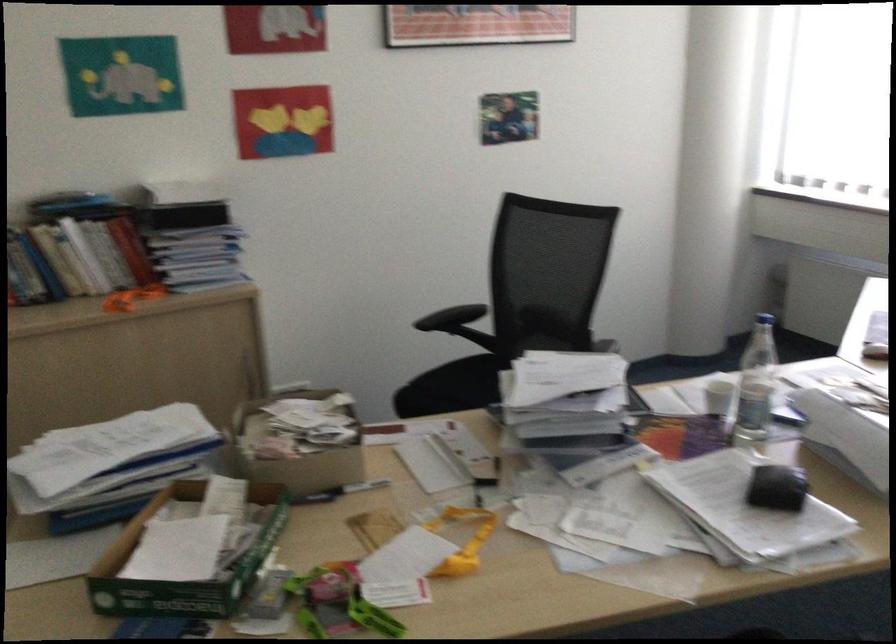
Where would you grip the green plastic handle? Please return your answer as a coordinate pair (x, y).

(345, 603)